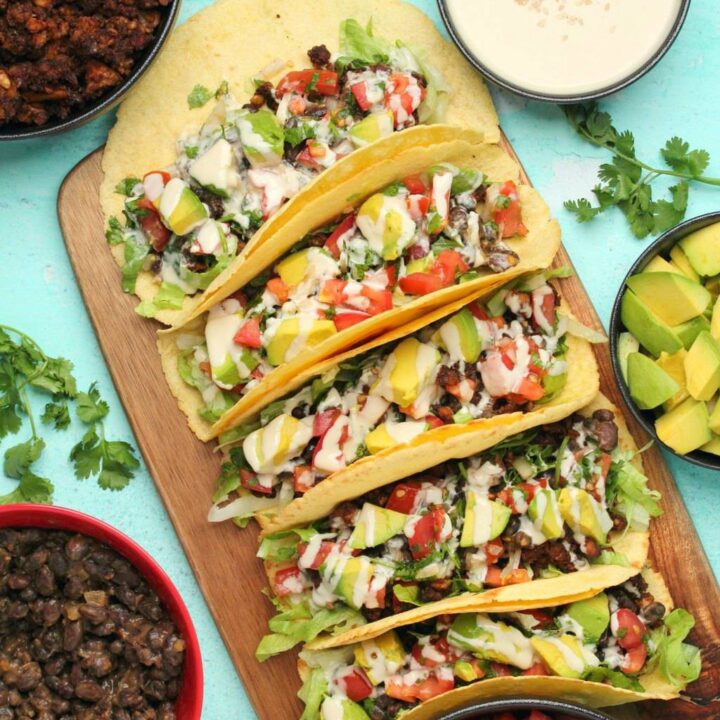
Find the location of a particular element. The width and height of the screenshot is (720, 720). red bowl is located at coordinates (132, 549).